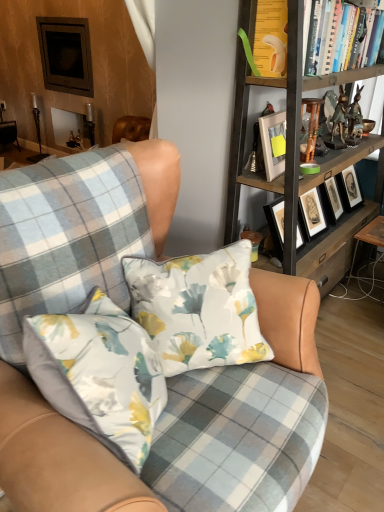
This screenshot has width=384, height=512. Describe the element at coordinates (273, 143) in the screenshot. I see `white matte picture frame at upper center` at that location.

What is the approximate width of hardcover books at upper right?

10.94 inches.

This screenshot has height=512, width=384. In order to click on plaid fabric chair at center in this screenshot , I will do `click(58, 458)`.

Measure the distance between point (297, 137) and camera.

Point (297, 137) and camera are 5.39 feet apart.

What is the approximate width of floral fabric pillow at center?

floral fabric pillow at center is 34.31 centimeters wide.

You are a GUI agent. You are given a task and a screenshot of the screen. Output one action in this format:
    pyautogui.click(x=<x>, y=<y>)
    Task: Click on the white matte picture frame at upper center
    This screenshot has height=512, width=384.
    Given the screenshot: What is the action you would take?
    pyautogui.click(x=273, y=143)

From a real-world perspective, is wooden bookshelf at upper right on wooden table at lower right?

Correct, in the physical world, wooden bookshelf at upper right is higher than wooden table at lower right.

In terms of width, does wooden bookshelf at upper right look wider or thinner when compared to wooden table at lower right?

wooden bookshelf at upper right is wider than wooden table at lower right.

How many degrees apart are the facing directions of wooden bookshelf at upper right and wooden table at lower right?

The angle between the facing direction of wooden bookshelf at upper right and the facing direction of wooden table at lower right is 91.6 degrees.

Consider the image. Is white matte picture frame at upper center oriented away from floral fabric pillow at center?

No, white matte picture frame at upper center's orientation is not away from floral fabric pillow at center.

Does white matte picture frame at upper center appear on the right side of floral fabric pillow at center?

Result: Yes, white matte picture frame at upper center is to the right of floral fabric pillow at center.

Where is `pillow lying below the white matte picture frame at upper center (from the image's perspective)`? This screenshot has width=384, height=512. pillow lying below the white matte picture frame at upper center (from the image's perspective) is located at coordinates (99, 374).

From a real-world perspective, is white matte picture frame at upper center physically located above or below floral fabric pillow at center?

In terms of real-world spatial position, white matte picture frame at upper center is above floral fabric pillow at center.

From the image's perspective, is floral fabric pillow at center located above or below plaid fabric chair at center?

floral fabric pillow at center is situated higher than plaid fabric chair at center in the image.

Relative to plaid fabric chair at center, is floral fabric pillow at center in front or behind?

Visually, floral fabric pillow at center is located behind plaid fabric chair at center.

Considering the sizes of objects floral fabric pillow at center and plaid fabric chair at center in the image provided, who is thinner, floral fabric pillow at center or plaid fabric chair at center?

floral fabric pillow at center is thinner.

Between floral fabric pillow at center and plaid fabric chair at center, which one appears on the left side from the viewer's perspective?

From the viewer's perspective, floral fabric pillow at center appears more on the left side.

From the image's perspective, is hardcover books at upper right beneath plaid fabric chair at center?

No.

Is hardcover books at upper right smaller than plaid fabric chair at center?

Yes.

The image size is (384, 512). What are the coordinates of `book above the plaid fabric chair at center (from the image's perspective)` in the screenshot? It's located at (341, 35).

Considering the positions of objects hardcover books at upper right and plaid fabric chair at center in the image provided, who is behind, hardcover books at upper right or plaid fabric chair at center?

Positioned behind is hardcover books at upper right.

Who is shorter, wooden table at lower right or white matte picture frame at upper center?

Standing shorter between the two is white matte picture frame at upper center.

From the image's perspective, is wooden table at lower right positioned above or below white matte picture frame at upper center?

wooden table at lower right is below white matte picture frame at upper center.

Considering the points (377, 239) and (268, 155), which point is in front, point (377, 239) or point (268, 155)?

The point (268, 155) is closer.

Considering their positions, is floral fabric pillow at center located in front of or behind hardcover books at upper right?

Visually, floral fabric pillow at center is located in front of hardcover books at upper right.

Considering the relative sizes of floral fabric pillow at center and hardcover books at upper right in the image provided, is floral fabric pillow at center shorter than hardcover books at upper right?

Incorrect, the height of floral fabric pillow at center does not fall short of that of hardcover books at upper right.

From a real-world perspective, is floral fabric pillow at center physically above hardcover books at upper right?

Incorrect, from a real-world perspective, floral fabric pillow at center is lower than hardcover books at upper right.

Are floral fabric pillow at center and hardcover books at upper right far apart?

Yes, floral fabric pillow at center and hardcover books at upper right are located far from each other.

Considering the points (146, 394) and (235, 129), which point is behind, point (146, 394) or point (235, 129)?

The point (235, 129) is behind.

Between floral fabric pillow at center and wooden bookshelf at upper right, which one has more height?

Standing taller between the two is wooden bookshelf at upper right.

Does floral fabric pillow at center appear on the left side of wooden bookshelf at upper right?

Correct, you'll find floral fabric pillow at center to the left of wooden bookshelf at upper right.

Considering the relative sizes of floral fabric pillow at center and wooden bookshelf at upper right in the image provided, is floral fabric pillow at center thinner than wooden bookshelf at upper right?

Correct, the width of floral fabric pillow at center is less than that of wooden bookshelf at upper right.

At what (x,y) coordinates should I click in order to perform the action: click on table beneath the wooden bookshelf at upper right (from a real-world perspective). Please return your answer as a coordinate pair (x, y). The image size is (384, 512). Looking at the image, I should click on (369, 238).

You are a GUI agent. You are given a task and a screenshot of the screen. Output one action in this format:
    pyautogui.click(x=<x>, y=<y>)
    Task: Click on the picture frame on the right of floral fabric pillow at center
    The width and height of the screenshot is (384, 512).
    Given the screenshot: What is the action you would take?
    pyautogui.click(x=273, y=143)

In the scene shown: From the image, which object appears to be farther from wooden table at lower right, plaid fabric chair at center or floral fabric pillow at center?

Among the two, plaid fabric chair at center is located further to wooden table at lower right.

From the image, which object appears to be farther from wooden bookshelf at upper right, white matte picture frame at upper center or plaid fabric chair at center?

Based on the image, plaid fabric chair at center appears to be further to wooden bookshelf at upper right.

Estimate the real-world distances between objects in this image. Which object is closer to hardcover books at upper right, wooden bookshelf at upper right or plaid fabric chair at center?

Based on the image, wooden bookshelf at upper right appears to be nearer to hardcover books at upper right.

Looking at the image, which one is located further to plaid fabric chair at center, hardcover books at upper right or wooden table at lower right?

The object further to plaid fabric chair at center is wooden table at lower right.

Which object lies further to the anchor point wooden bookshelf at upper right, white matte picture frame at upper center or wooden table at lower right?

Based on the image, wooden table at lower right appears to be further to wooden bookshelf at upper right.

When comparing their distances from white matte picture frame at upper center, does hardcover books at upper right or wooden table at lower right seem closer?

Among the two, hardcover books at upper right is located nearer to white matte picture frame at upper center.

Estimate the real-world distances between objects in this image. Which object is closer to plaid fabric chair at center, hardcover books at upper right or wooden bookshelf at upper right?

wooden bookshelf at upper right is positioned closer to the anchor plaid fabric chair at center.

From the image, which object appears to be nearer to white matte picture frame at upper center, floral fabric pillow at center or plaid fabric chair at center?

floral fabric pillow at center is positioned closer to the anchor white matte picture frame at upper center.

I want to click on picture frame that lies between hardcover books at upper right and wooden bookshelf at upper right from top to bottom, so click(273, 143).

The image size is (384, 512). Find the location of `bookcase between hardcover books at upper right and wooden table at lower right from top to bottom`. bookcase between hardcover books at upper right and wooden table at lower right from top to bottom is located at coordinates (287, 154).

You are a GUI agent. You are given a task and a screenshot of the screen. Output one action in this format:
    pyautogui.click(x=<x>, y=<y>)
    Task: Click on the chair between floral fabric pillow at center and wooden bookshelf at upper right
    
    Given the screenshot: What is the action you would take?
    pyautogui.click(x=58, y=458)

Where is `bookcase positioned between floral fabric pillow at center and wooden table at lower right from near to far`? The image size is (384, 512). bookcase positioned between floral fabric pillow at center and wooden table at lower right from near to far is located at coordinates (287, 154).